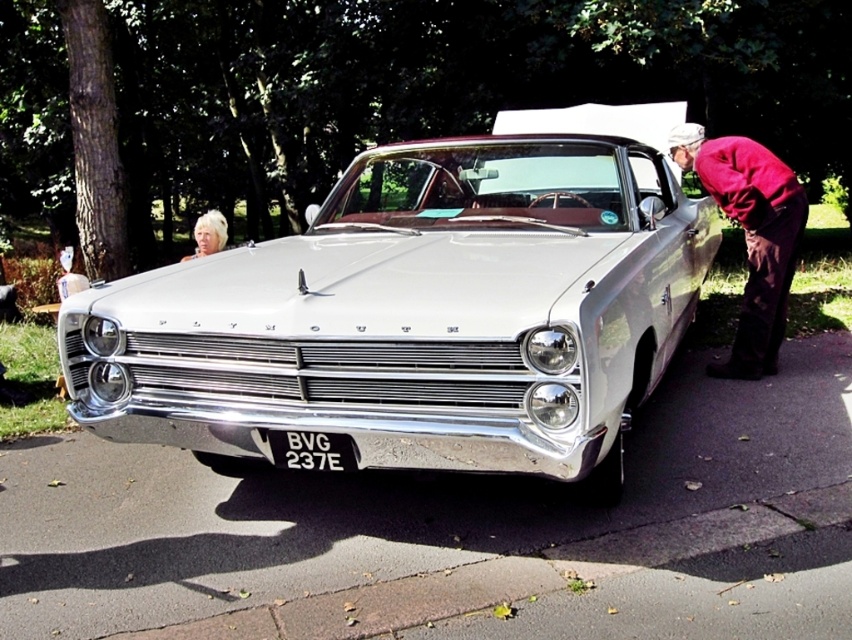
Question: From the image, what is the correct spatial relationship of maroon fabric coat at right in relation to black plastic license plate at center?

Choices:
 (A) above
 (B) below

Answer: (A)

Question: Observing the image, what is the correct spatial positioning of maroon fabric coat at right in reference to blonde hair at upper left?

Choices:
 (A) above
 (B) below

Answer: (B)

Question: Which of the following is the farthest from the observer?

Choices:
 (A) (269, 432)
 (B) (773, 195)

Answer: (B)

Question: Which object is the farthest from the white metallic car at center?

Choices:
 (A) maroon fabric coat at right
 (B) blonde hair at upper left

Answer: (B)

Question: Does white metallic car at center have a lesser width compared to blonde hair at upper left?

Choices:
 (A) no
 (B) yes

Answer: (A)

Question: Estimate the real-world distances between objects in this image. Which object is closer to the black plastic license plate at center?

Choices:
 (A) maroon fabric coat at right
 (B) white metallic car at center
 (C) blonde hair at upper left

Answer: (B)